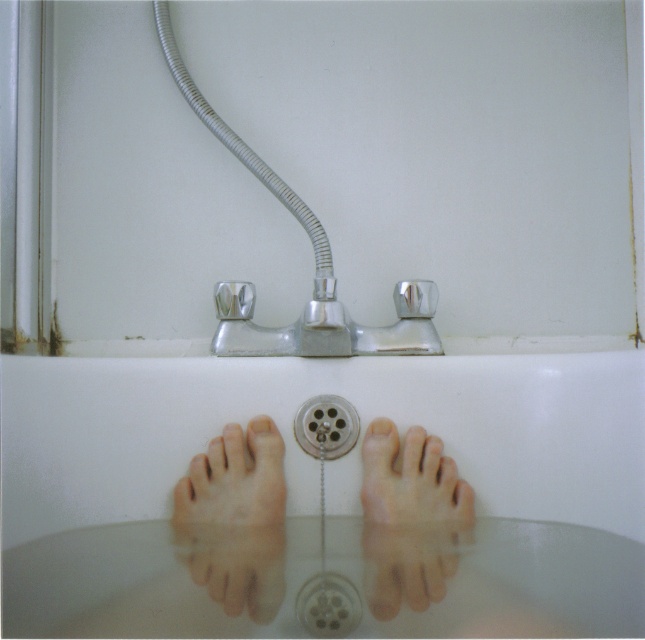
Question: Can you confirm if chrome metallic shower head at upper center is positioned to the left of silver metallic drain at center?

Choices:
 (A) no
 (B) yes

Answer: (B)

Question: Which object appears farthest from the camera in this image?

Choices:
 (A) pink flesh toe at center
 (B) pale skin toe at center

Answer: (B)

Question: Among these objects, which one is nearest to the camera?

Choices:
 (A) white glossy bathtub at center
 (B) pale skin toe at center
 (C) matte skin toe at center
 (D) chrome/metallic faucet at center

Answer: (A)

Question: Is pale skin foot at center to the left of pale skin toe at center from the viewer's perspective?

Choices:
 (A) no
 (B) yes

Answer: (A)

Question: Which point appears closest to the camera in this image?

Choices:
 (A) click(368, 348)
 (B) click(317, 424)
 (C) click(342, 586)

Answer: (C)

Question: Does skinny flesh-toned feet at center lie in front of silver metallic drain at center?

Choices:
 (A) yes
 (B) no

Answer: (A)